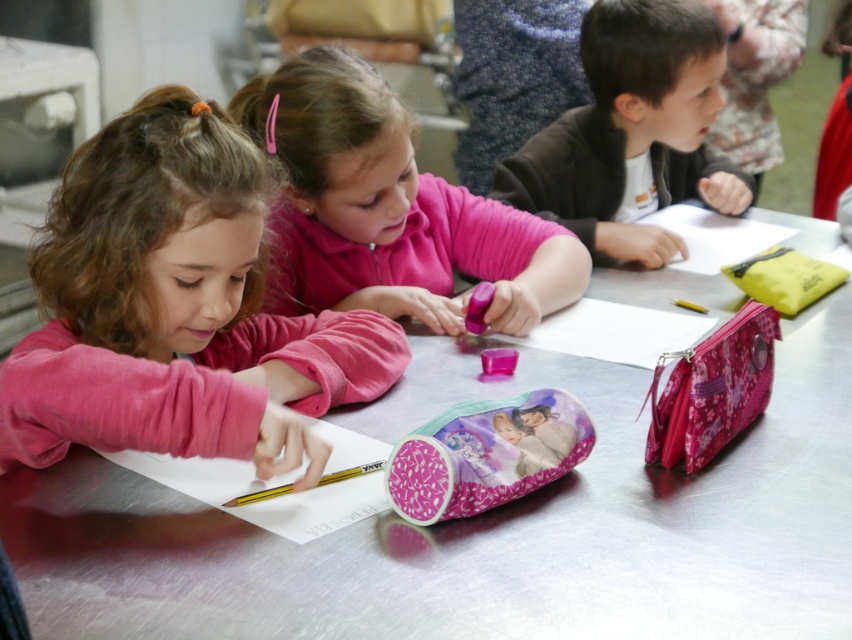
Based on the photo, is metallic silver table at center shorter than pink matte pencil case at center?

In fact, metallic silver table at center may be taller than pink matte pencil case at center.

Between metallic silver table at center and pink matte pencil case at center, which one is positioned higher?

Positioned higher is pink matte pencil case at center.

Which is in front, point (565, 381) or point (452, 253)?

Point (565, 381) is more forward.

Locate an element on the screen. Image resolution: width=852 pixels, height=640 pixels. metallic silver table at center is located at coordinates (482, 525).

How far apart are metallic silver table at center and pink fabric child at center?

→ A distance of 9.97 inches exists between metallic silver table at center and pink fabric child at center.

Is metallic silver table at center taller than pink fabric child at center?

Correct, metallic silver table at center is much taller as pink fabric child at center.

The width and height of the screenshot is (852, 640). Identify the location of metallic silver table at center. (482, 525).

Can you confirm if pink fabric child at center is positioned above pink matte pencil case at center?

No.

Who is positioned more to the right, pink fabric child at center or pink matte pencil case at center?

Positioned to the right is pink matte pencil case at center.

Between point (53, 387) and point (306, 168), which one is positioned behind?

The point (306, 168) is more distant.

Locate an element on the screen. pink fabric child at center is located at coordinates (176, 307).